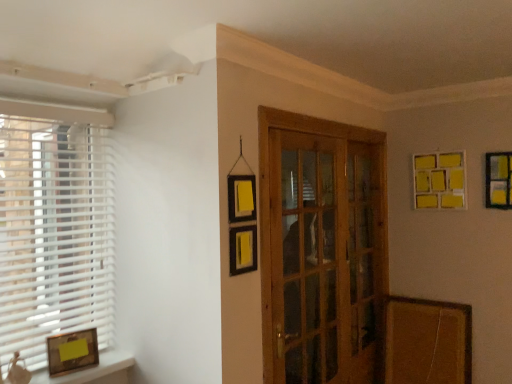
Question: From their relative heights in the image, would you say wooden glass door at center is taller or shorter than white plastic blinds at left?

Choices:
 (A) short
 (B) tall

Answer: (B)

Question: In terms of size, does wooden glass door at center appear bigger or smaller than white plastic blinds at left?

Choices:
 (A) small
 (B) big

Answer: (B)

Question: Which object is positioned farthest from the yellow matte picture frame at upper right, marked as the 2th picture frame in a bottom-to-top arrangement?

Choices:
 (A) wooden glass door at center
 (B) matte gold picture frame at lower left, which is counted as the third picture frame, starting from the right
 (C) yellow matte picture frame at upper right, which is counted as the third picture frame, starting from the bottom
 (D) white plastic blinds at left

Answer: (B)

Question: Which of these objects is positioned farthest from the white plastic blinds at left?

Choices:
 (A) yellow matte picture frame at upper right, acting as the 2th picture frame starting from the top
 (B) yellow matte picture frame at upper right, positioned as the 1th picture frame in top-to-bottom order
 (C) wooden glass door at center
 (D) matte gold picture frame at lower left, which is counted as the third picture frame, starting from the right

Answer: (A)